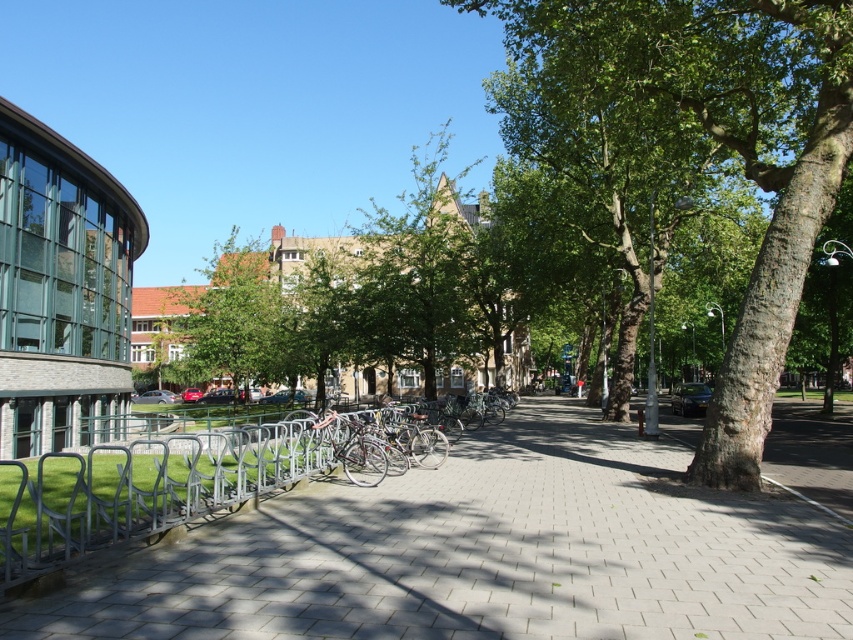
Does gray concrete pavement at center have a greater height compared to green leafy tree at center?

No, gray concrete pavement at center is not taller than green leafy tree at center.

Does point (705, 564) come behind point (178, 369)?

No, it is in front of (178, 369).

Is point (84, 632) positioned before point (257, 266)?

Yes.

Locate an element on the screen. The height and width of the screenshot is (640, 853). gray concrete pavement at center is located at coordinates (483, 554).

Which is in front, point (563, 609) or point (173, 452)?

Point (563, 609)

Who is taller, gray concrete pavement at center or silver metallic bike rack at left?

silver metallic bike rack at left

Which is behind, point (282, 608) or point (218, 508)?

Positioned behind is point (218, 508).

You are a GUI agent. You are given a task and a screenshot of the screen. Output one action in this format:
    pyautogui.click(x=<x>, y=<y>)
    Task: Click on the gray concrete pavement at center
    
    Given the screenshot: What is the action you would take?
    pyautogui.click(x=483, y=554)

Does green rough bark tree at center come in front of silver metallic bike rack at left?

No, it is behind silver metallic bike rack at left.

How distant is green rough bark tree at center from silver metallic bike rack at left?

Result: The distance of green rough bark tree at center from silver metallic bike rack at left is 10.78 meters.

Find the location of `green rough bark tree at center`. green rough bark tree at center is located at coordinates (730, 150).

Where is `green rough bark tree at center`? The image size is (853, 640). green rough bark tree at center is located at coordinates (730, 150).